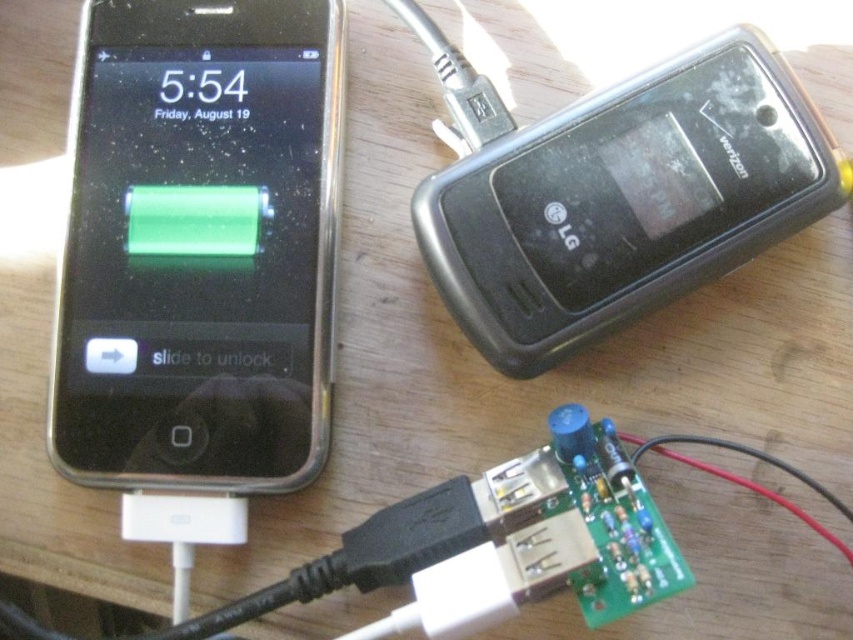
Who is more forward, (x=325, y=76) or (x=560, y=172)?

Point (x=560, y=172)

Where is `black glossy smartphone at left`? black glossy smartphone at left is located at coordinates (198, 250).